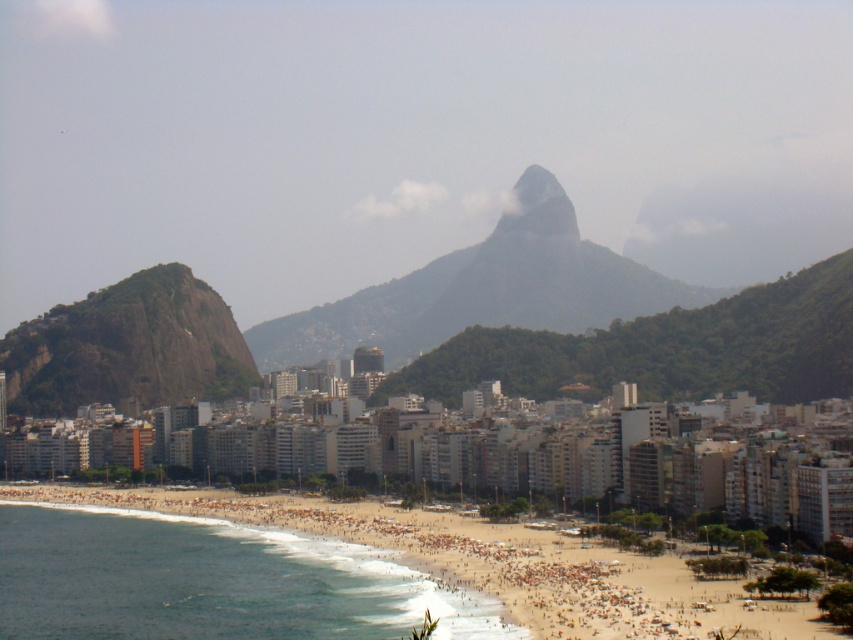
What is the 2D coordinate of the rocky gray mountain at center in the image?

The 2D coordinate of the rocky gray mountain at center is at point [485,289].

You are standing at the beach looking towards the mountains. There are two points marked on the mountainside. One is at coordinate point (347, 547) and the other at point (142, 323). Which point is closer to your current position?

Point (347, 547) is closer to the camera than point (142, 323), so the point at coordinate point (347, 547) is closer to your current position.